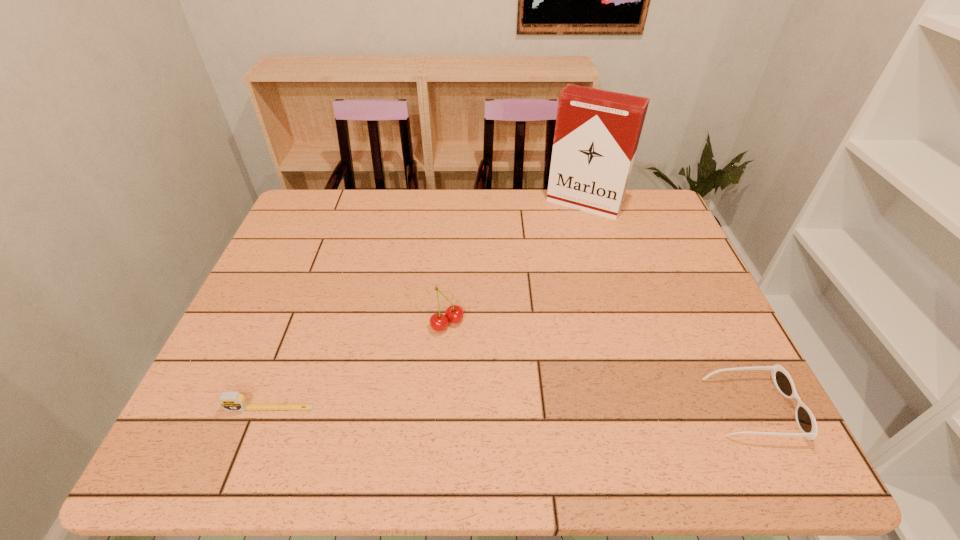
This screenshot has width=960, height=540. I want to click on object present at the near right corner, so click(x=806, y=422).

The image size is (960, 540). In the image, there is a desktop. What are the coordinates of `vacant space at the far edge` in the screenshot? It's located at (444, 210).

This screenshot has height=540, width=960. In order to click on vacant region at the near edge of the desktop in this screenshot , I will do `click(327, 384)`.

At what (x,y) coordinates should I click in order to perform the action: click on vacant space at the left edge of the desktop. Please return your answer as a coordinate pair (x, y). Looking at the image, I should click on (276, 347).

In the image, there is a desktop. Identify the location of blank space at the right edge. The height and width of the screenshot is (540, 960). (679, 260).

Find the location of a particular element. vacant area at the far left corner of the desktop is located at coordinates (342, 203).

The width and height of the screenshot is (960, 540). What are the coordinates of `free space at the far right corner of the desktop` in the screenshot? It's located at (656, 221).

Locate an element on the screen. The width and height of the screenshot is (960, 540). vacant space at the near right corner of the desktop is located at coordinates (754, 393).

Where is `free point between the sunglasses and the second object from right to left`? The height and width of the screenshot is (540, 960). free point between the sunglasses and the second object from right to left is located at coordinates click(668, 306).

Where is `vacant point located between the sunglasses and the second tallest object`? The height and width of the screenshot is (540, 960). vacant point located between the sunglasses and the second tallest object is located at coordinates (600, 366).